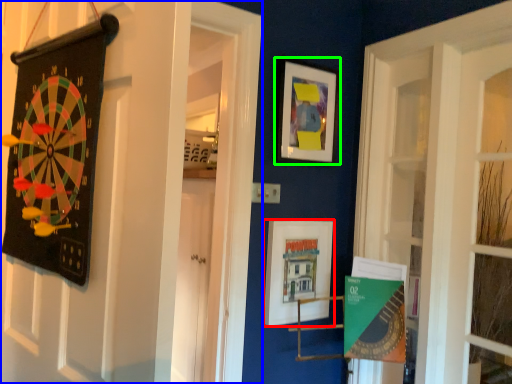
Question: Which is nearer to the picture frame (highlighted by a red box)? door (highlighted by a blue box) or picture frame (highlighted by a green box).

Choices:
 (A) door
 (B) picture frame

Answer: (B)